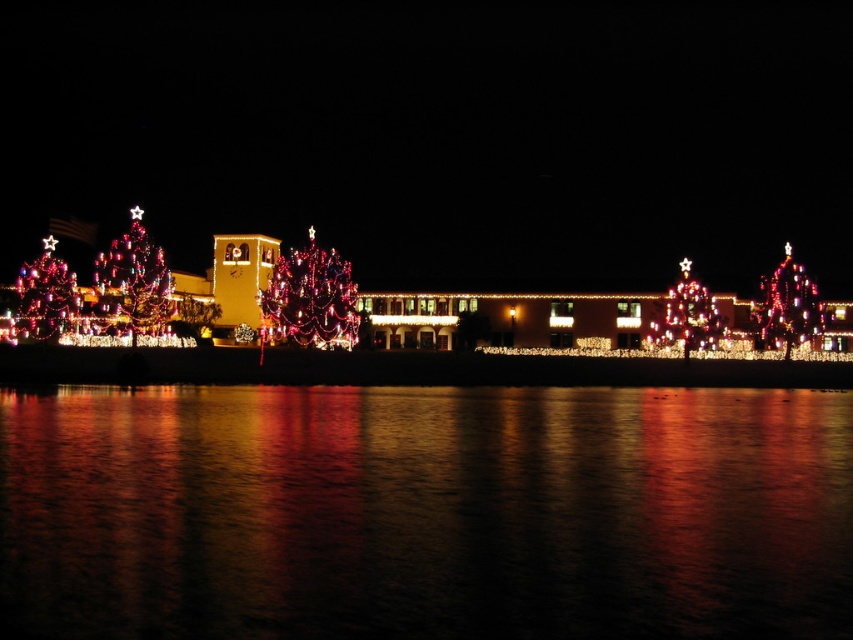
Question: Which point appears closest to the camera in this image?

Choices:
 (A) (680, 278)
 (B) (48, 300)
 (C) (131, 296)

Answer: (C)

Question: Which is farther from the illuminated glass christmas tree at right?

Choices:
 (A) glossy reflective water at center
 (B) illuminated glass christmas tree at center
 (C) shiny metallic christmas tree at left

Answer: (C)

Question: Which object is the closest to the glossy reflective water at center?

Choices:
 (A) iridescent glass christmas tree at center
 (B) illuminated glass christmas tree at center
 (C) shiny red christmas tree at left
 (D) illuminated glass christmas tree at right

Answer: (A)

Question: Is iridescent glass christmas tree at center below illuminated glass christmas tree at center?

Choices:
 (A) yes
 (B) no

Answer: (B)

Question: From the image, what is the correct spatial relationship of shiny red christmas tree at left in relation to illuminated glass christmas tree at right?

Choices:
 (A) left
 (B) right

Answer: (A)

Question: Does glossy reflective water at center have a greater width compared to shiny red christmas tree at left?

Choices:
 (A) yes
 (B) no

Answer: (A)